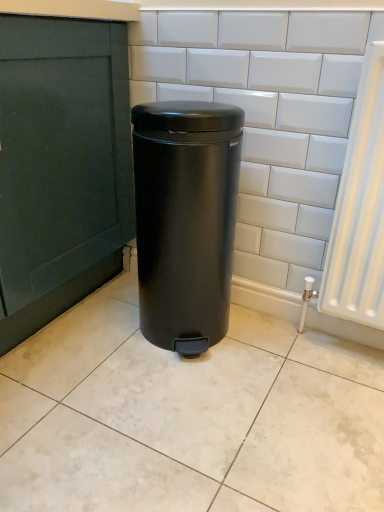
What do you see at coordinates (188, 417) in the screenshot? I see `white glossy ceramic tile at center` at bounding box center [188, 417].

Locate an element on the screen. white glossy ceramic tile at center is located at coordinates (188, 417).

What is the approximate width of matte black trash can at center?

It is 14.27 inches.

What is the approximate height of matte black trash can at center?

70.49 centimeters.

The image size is (384, 512). What do you see at coordinates (185, 219) in the screenshot?
I see `matte black trash can at center` at bounding box center [185, 219].

Find the location of a particular element. This screenshot has width=384, height=512. matte black trash can at center is located at coordinates pyautogui.click(x=185, y=219).

Image resolution: width=384 pixels, height=512 pixels. I want to click on white glossy ceramic tile at center, so click(x=188, y=417).

Does white glossy ceramic tile at center appear on the right side of matte black trash can at center?

Incorrect, white glossy ceramic tile at center is not on the right side of matte black trash can at center.

Consider the image. Which object is further away from the camera taking this photo, white glossy ceramic tile at center or matte black trash can at center?

Positioned behind is matte black trash can at center.

Is point (288, 377) in front of point (206, 129)?

No.

Consider the image. From the image's perspective, which is below, white glossy ceramic tile at center or matte black trash can at center?

white glossy ceramic tile at center.

From a real-world perspective, which is physically above, white glossy ceramic tile at center or matte black trash can at center?

From a 3D spatial view, matte black trash can at center is above.

Can you confirm if white glossy ceramic tile at center is thinner than matte black trash can at center?

No, white glossy ceramic tile at center is not thinner than matte black trash can at center.

From the picture: Between white glossy ceramic tile at center and matte black trash can at center, which one has less height?

white glossy ceramic tile at center is shorter.

Does white glossy ceramic tile at center have a smaller size compared to matte black trash can at center?

Yes, white glossy ceramic tile at center is smaller than matte black trash can at center.

Is white glossy ceramic tile at center not inside matte black trash can at center?

Absolutely, white glossy ceramic tile at center is external to matte black trash can at center.

Consider the image. Is white glossy ceramic tile at center touching matte black trash can at center?

white glossy ceramic tile at center and matte black trash can at center are not in contact.

Is white glossy ceramic tile at center facing towards matte black trash can at center?

No, white glossy ceramic tile at center is not oriented towards matte black trash can at center.

How different are the orientations of white glossy ceramic tile at center and matte black trash can at center in degrees?

The angular difference between white glossy ceramic tile at center and matte black trash can at center is 87.9 degrees.

The width and height of the screenshot is (384, 512). I want to click on ceramic tile in front of the matte black trash can at center, so click(188, 417).

Based on their positions, is matte black trash can at center located to the left or right of white glossy ceramic tile at center?

From the image, it's evident that matte black trash can at center is to the right of white glossy ceramic tile at center.

Relative to white glossy ceramic tile at center, is matte black trash can at center in front or behind?

Clearly, matte black trash can at center is behind white glossy ceramic tile at center.

Which is less distant, (214, 339) or (129, 455)?

Point (129, 455)

From the image's perspective, is matte black trash can at center on top of white glossy ceramic tile at center?

Yes, from the image's perspective, matte black trash can at center is on top of white glossy ceramic tile at center.

From a real-world perspective, relative to white glossy ceramic tile at center, is matte black trash can at center vertically above or below?

matte black trash can at center is above white glossy ceramic tile at center.

Can you confirm if matte black trash can at center is thinner than white glossy ceramic tile at center?

Yes.

Who is taller, matte black trash can at center or white glossy ceramic tile at center?

matte black trash can at center is taller.

From the picture: Between matte black trash can at center and white glossy ceramic tile at center, which one has larger size?

With larger size is matte black trash can at center.

Would you say white glossy ceramic tile at center is part of matte black trash can at center's contents?

No, white glossy ceramic tile at center is located outside of matte black trash can at center.

Is matte black trash can at center beside white glossy ceramic tile at center?

matte black trash can at center and white glossy ceramic tile at center are not in contact.

Does matte black trash can at center turn towards white glossy ceramic tile at center?

Yes, matte black trash can at center is turned towards white glossy ceramic tile at center.

Measure the distance from matte black trash can at center to white glossy ceramic tile at center.

matte black trash can at center and white glossy ceramic tile at center are 13.56 inches apart from each other.

You are a GUI agent. You are given a task and a screenshot of the screen. Output one action in this format:
    pyautogui.click(x=<x>, y=<y>)
    Task: Click on the waste container lying behind the white glossy ceramic tile at center
    This screenshot has height=512, width=384.
    Given the screenshot: What is the action you would take?
    point(185,219)

The image size is (384, 512). What are the coordinates of `waste container behind the white glossy ceramic tile at center` in the screenshot? It's located at (185, 219).

The width and height of the screenshot is (384, 512). In order to click on waste container on the right of white glossy ceramic tile at center in this screenshot , I will do `click(185, 219)`.